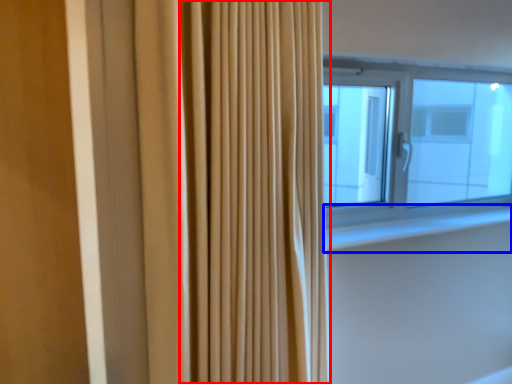
Question: Which of the following is the closest to the observer, shower curtain (highlighted by a red box) or window sill (highlighted by a blue box)?

Choices:
 (A) shower curtain
 (B) window sill

Answer: (A)